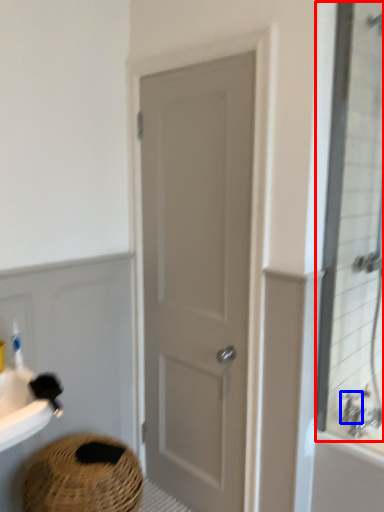
Question: Which of the following is the farthest to the observer, mirror (highlighted by a red box) or faucet (highlighted by a blue box)?

Choices:
 (A) mirror
 (B) faucet

Answer: (B)